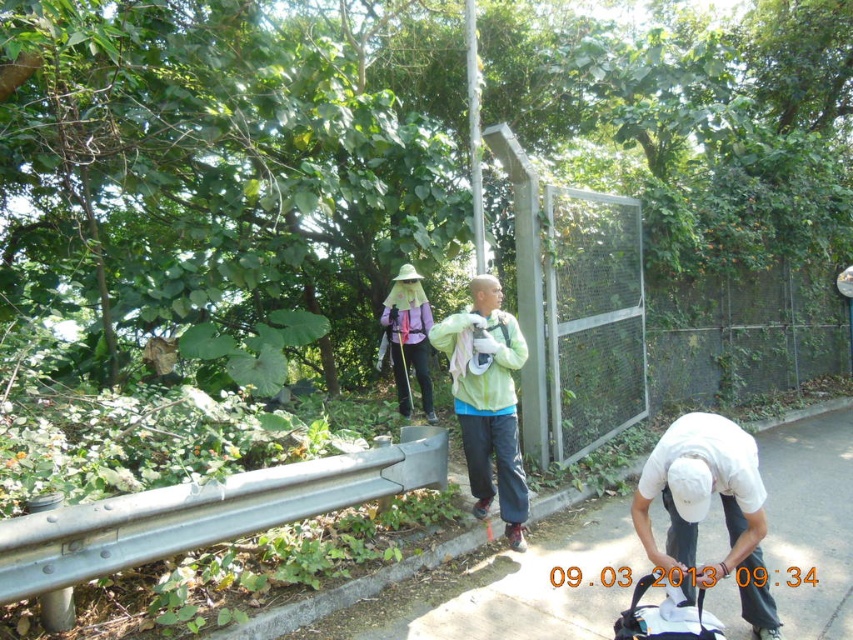
Looking at this image, does white matte shirt at lower right have a smaller size compared to white fabric baby carriage at lower right?

Actually, white matte shirt at lower right might be larger than white fabric baby carriage at lower right.

Is point (723, 435) positioned after point (677, 634)?

That is True.

Is point (747, 461) positioned after point (636, 611)?

No, (747, 461) is closer to viewer.

Identify the location of white matte shirt at lower right. The width and height of the screenshot is (853, 640). (706, 509).

Can you confirm if white matte shirt at lower right is shorter than green matte jacket at center?

Yes.

Is point (706, 433) behind point (496, 362)?

No.

Is point (692, 467) positioned before point (505, 336)?

Yes, it is in front of point (505, 336).

At what (x,y) coordinates should I click in order to perform the action: click on white matte shirt at lower right. Please return your answer as a coordinate pair (x, y). Image resolution: width=853 pixels, height=640 pixels. Looking at the image, I should click on (706, 509).

Is green matte jacket at center smaller than white fabric baby carriage at lower right?

No, green matte jacket at center is not smaller than white fabric baby carriage at lower right.

Can you confirm if green matte jacket at center is positioned to the left of white fabric baby carriage at lower right?

Correct, you'll find green matte jacket at center to the left of white fabric baby carriage at lower right.

Between point (523, 545) and point (703, 621), which one is positioned in front?

Point (703, 621) is more forward.

This screenshot has height=640, width=853. I want to click on green matte jacket at center, so click(486, 401).